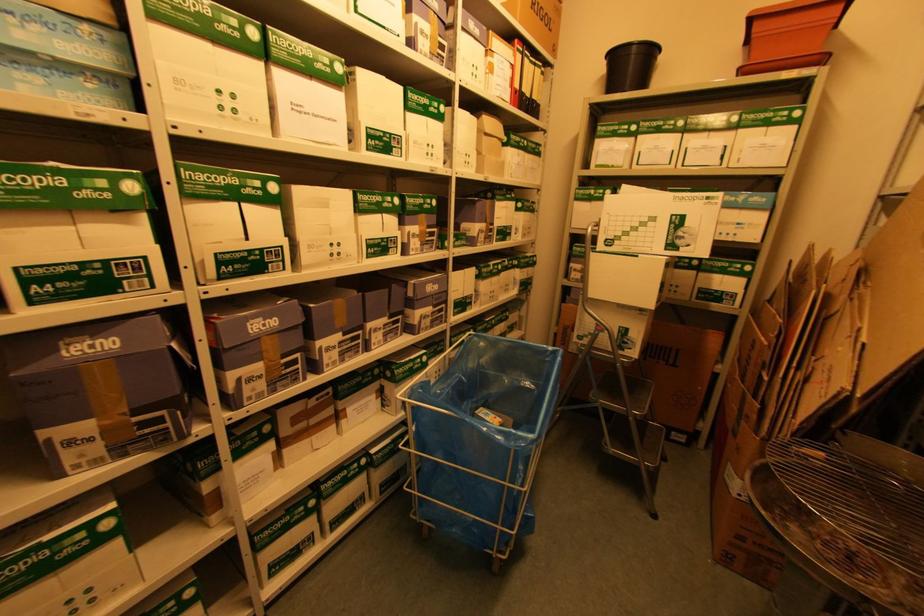
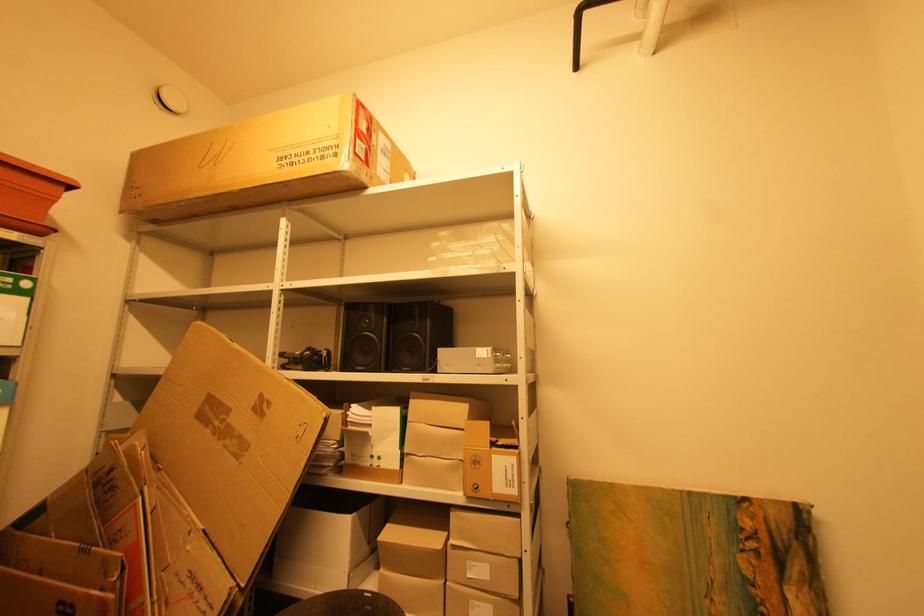
Question: The camera is either moving clockwise (left) or counter-clockwise (right) around the object. The first image is from the beginning of the video and the second image is from the end. Is the camera moving left or right when shooting the video?

Choices:
 (A) Left
 (B) Right

Answer: (A)